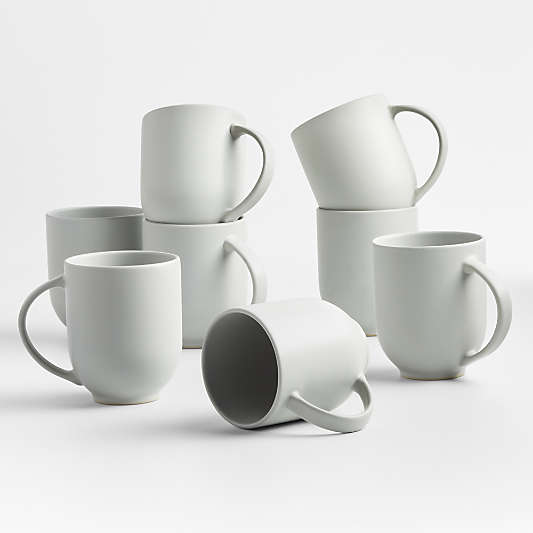
This screenshot has width=533, height=533. What are the coordinates of `staked cups` in the screenshot? It's located at (203, 270), (184, 159), (340, 153), (346, 234).